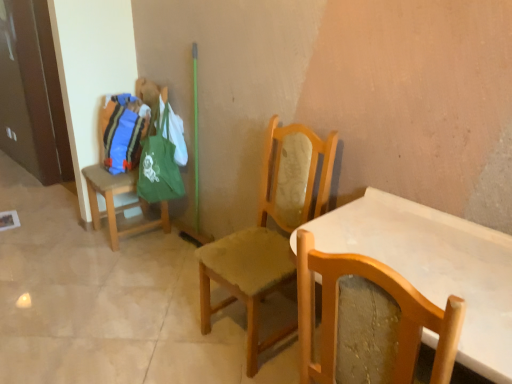
Question: Is point (400, 357) closer or farther from the camera than point (106, 104)?

Choices:
 (A) closer
 (B) farther

Answer: (A)

Question: Is wooden chair at right, which is the first chair in front-to-back order, situated inside wooden stool at left, the third chair when ordered from front to back, or outside?

Choices:
 (A) inside
 (B) outside

Answer: (B)

Question: Estimate the real-world distances between objects in this image. Which object is farther from the wooden chair at center, which ranks as the second chair in back-to-front order?

Choices:
 (A) wooden chair at right, the 1th chair in the right-to-left sequence
 (B) wooden stool at left, which is the first chair in left-to-right order

Answer: (B)

Question: Considering the real-world distances, which object is closest to the wooden stool at left, which is the first chair in left-to-right order?

Choices:
 (A) wooden chair at center, the second chair from the front
 (B) wooden chair at right, arranged as the third chair when viewed from the left

Answer: (A)